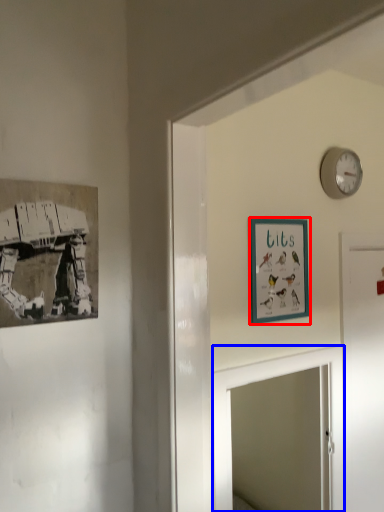
Question: Which point is further to the camera, picture frame (highlighted by a red box) or mirror (highlighted by a blue box)?

Choices:
 (A) picture frame
 (B) mirror

Answer: (A)